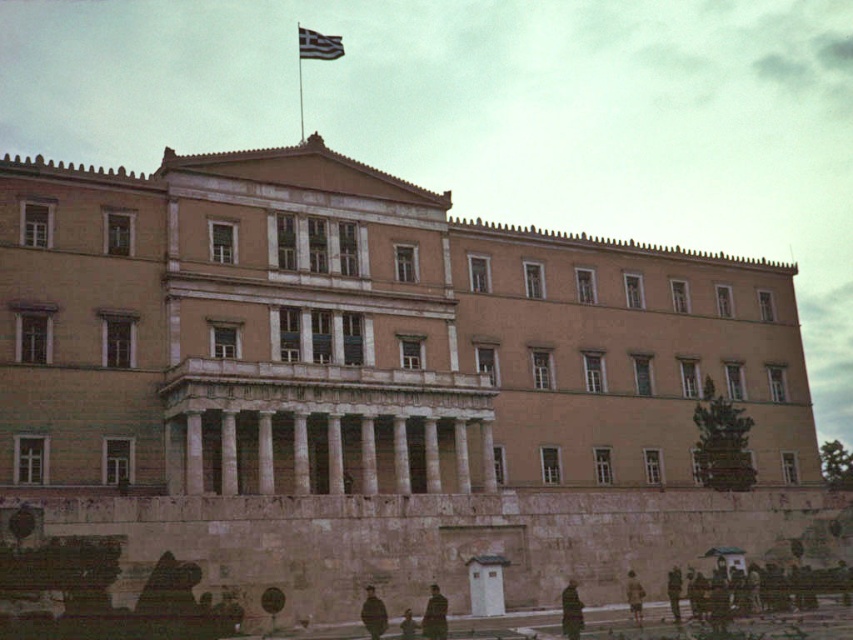
Question: Is white fabric flag at upper center thinner than metallic flag pole at upper center?

Choices:
 (A) no
 (B) yes

Answer: (B)

Question: Is white fabric flag at upper center wider than metallic flag pole at upper center?

Choices:
 (A) yes
 (B) no

Answer: (B)

Question: Which of the following is the closest to the observer?

Choices:
 (A) (302, 102)
 (B) (335, 56)

Answer: (B)

Question: Is white fabric flag at upper center below metallic flag pole at upper center?

Choices:
 (A) yes
 (B) no

Answer: (B)

Question: Among these objects, which one is farthest from the camera?

Choices:
 (A) white fabric flag at upper center
 (B) metallic flag pole at upper center

Answer: (A)